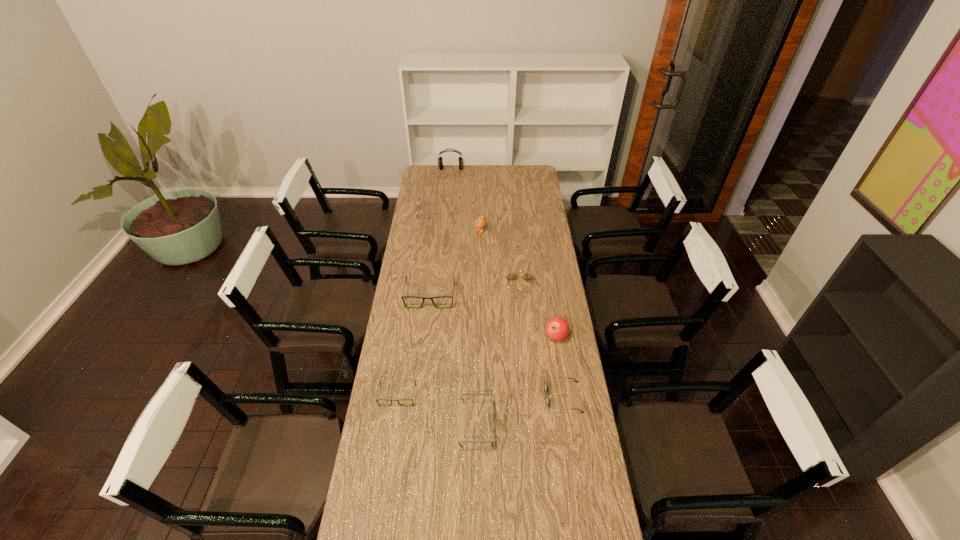
The image size is (960, 540). Identify the location of the farthest object. (440, 162).

Image resolution: width=960 pixels, height=540 pixels. Find the location of `the tallest object`. the tallest object is located at coordinates (440, 162).

Locate an element on the screen. teddy bear is located at coordinates (480, 222).

You are a GUI agent. You are given a task and a screenshot of the screen. Output one action in this format:
    pyautogui.click(x=<x>, y=<y>)
    Task: Click on the seventh nearest object
    This screenshot has width=960, height=540.
    Given the screenshot: What is the action you would take?
    pyautogui.click(x=480, y=222)

In order to click on the sixth farthest object in this screenshot , I will do `click(557, 328)`.

Image resolution: width=960 pixels, height=540 pixels. Find the location of `red apple`. red apple is located at coordinates (557, 328).

What are the coordinates of `the tallest spectacles` in the screenshot? It's located at (403, 296).

The width and height of the screenshot is (960, 540). I want to click on the sixth shortest object, so click(x=403, y=296).

Locate an element on the screen. Image resolution: width=960 pixels, height=540 pixels. the eighth nearest object is located at coordinates (418, 206).

Find the location of `the bigger yellow spectacles`. the bigger yellow spectacles is located at coordinates (418, 206).